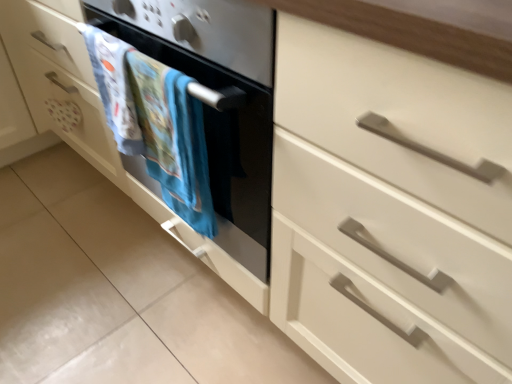
Image resolution: width=512 pixels, height=384 pixels. Find the location of `vacant space underneath blue cotton towel at center (from a real-world perspective)`. vacant space underneath blue cotton towel at center (from a real-world perspective) is located at coordinates (167, 282).